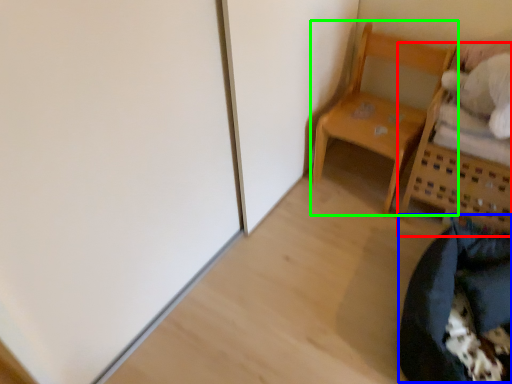
Question: Which object is the farthest from furniture (highlighted by a red box)? Choose among these: bean bag chair (highlighted by a blue box) or furniture (highlighted by a green box).

Choices:
 (A) bean bag chair
 (B) furniture

Answer: (A)